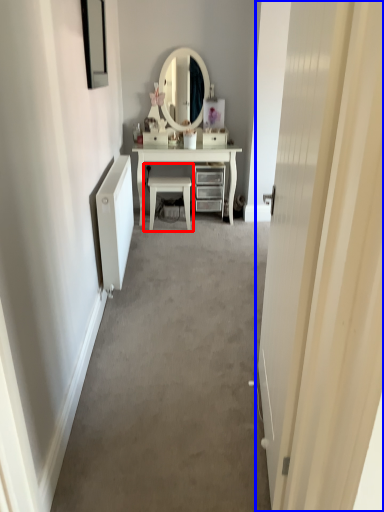
Question: Among these objects, which one is farthest to the camera, chair (highlighted by a red box) or door (highlighted by a blue box)?

Choices:
 (A) chair
 (B) door

Answer: (A)